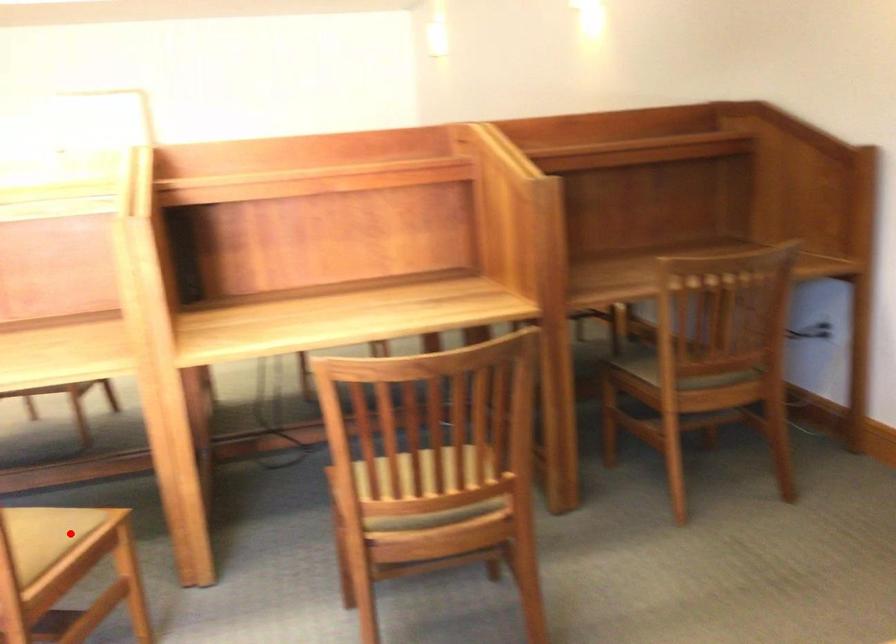
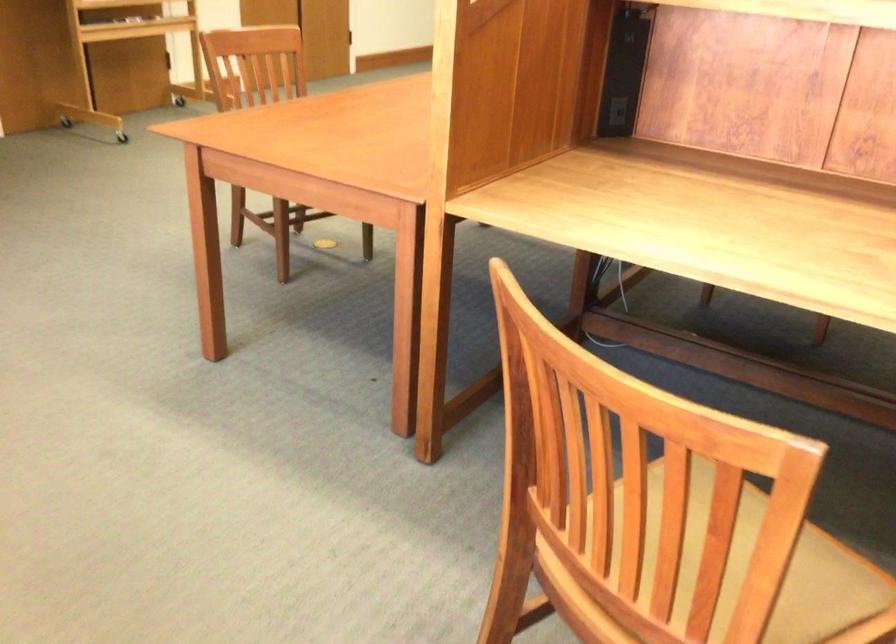
In the second image, find the point that corresponds to the highlighted location in the first image.

(833, 594)